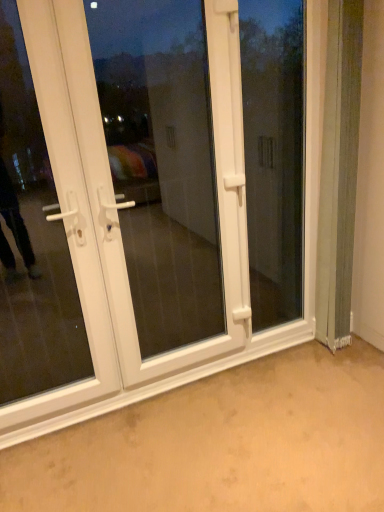
Question: Is white plastic door at left, which ranks as the first door in left-to-right order, aimed at white plastic screen door at center?

Choices:
 (A) no
 (B) yes

Answer: (A)

Question: Is white plastic door at left, which ranks as the first door in left-to-right order, surrounding white plastic screen door at center?

Choices:
 (A) yes
 (B) no

Answer: (B)

Question: From a real-world perspective, is white plastic door at left, which ranks as the first door in left-to-right order, physically below white plastic screen door at center?

Choices:
 (A) no
 (B) yes

Answer: (A)

Question: Is the position of white plastic door at left, which ranks as the first door in left-to-right order, more distant than that of white plastic screen door at center?

Choices:
 (A) no
 (B) yes

Answer: (A)

Question: Can you confirm if white plastic door at left, which ranks as the first door in left-to-right order, is positioned to the left of white plastic screen door at center?

Choices:
 (A) yes
 (B) no

Answer: (A)

Question: Is white plastic door at center, the 1th door when ordered from right to left, to the left or to the right of white plastic screen door at center in the image?

Choices:
 (A) right
 (B) left

Answer: (B)

Question: In terms of size, does white plastic door at center, the 1th door when ordered from right to left, appear bigger or smaller than white plastic screen door at center?

Choices:
 (A) small
 (B) big

Answer: (B)

Question: From a real-world perspective, is white plastic door at center, which is counted as the second door, starting from the left, above or below white plastic screen door at center?

Choices:
 (A) below
 (B) above

Answer: (A)

Question: Is white plastic door at center, the 1th door when ordered from right to left, wider or thinner than white plastic screen door at center?

Choices:
 (A) thin
 (B) wide

Answer: (A)

Question: In the image, is white plastic door at left, which ranks as the first door in left-to-right order, on the left side or the right side of white plastic screen door at center?

Choices:
 (A) left
 (B) right

Answer: (A)

Question: From a real-world perspective, is white plastic door at left, which ranks as the first door in left-to-right order, physically located above or below white plastic screen door at center?

Choices:
 (A) below
 (B) above

Answer: (B)

Question: In terms of height, does white plastic door at left, which ranks as the first door in left-to-right order, look taller or shorter compared to white plastic screen door at center?

Choices:
 (A) short
 (B) tall

Answer: (B)

Question: Considering the positions of point (69, 166) and point (107, 239), is point (69, 166) closer or farther from the camera than point (107, 239)?

Choices:
 (A) closer
 (B) farther

Answer: (A)

Question: From a real-world perspective, is white plastic door at left, which ranks as the first door in left-to-right order, physically located above or below transparent glass window at center?

Choices:
 (A) below
 (B) above

Answer: (B)

Question: In terms of size, does white plastic door at left, which ranks as the first door in left-to-right order, appear bigger or smaller than transparent glass window at center?

Choices:
 (A) big
 (B) small

Answer: (A)